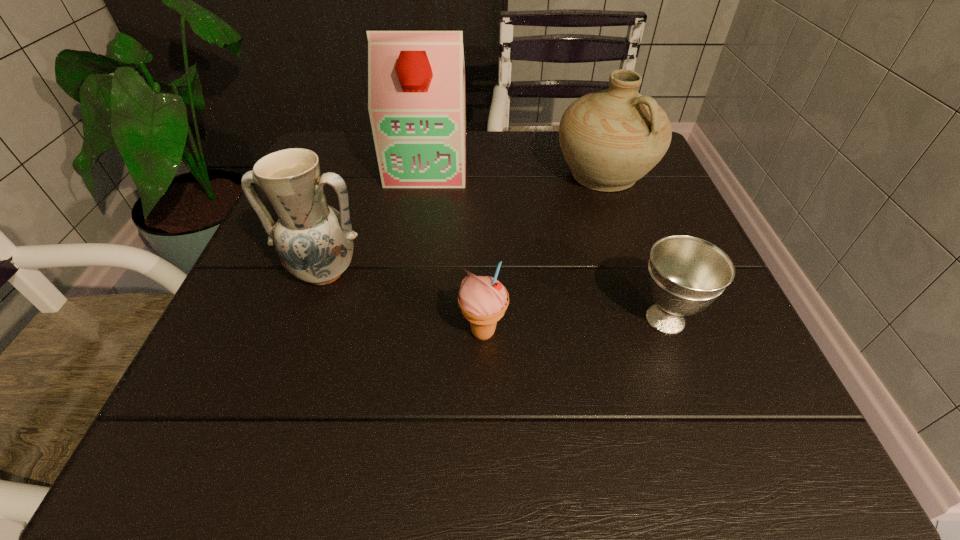
Select which object appears as the closest to the right pottery. Please provide its 2D coordinates. Your answer should be formatted as a tuple, i.e. [(x, y)], where the tuple contains the x and y coordinates of a point satisfying the conditions above.

[(416, 77)]

What are the coordinates of `vacant space that satisfies the following two spatial constraints: 1. on either side of the icecream; 2. on the left side of the left pottery` in the screenshot? It's located at (303, 333).

Find the location of `free space that satisfies the following two spatial constraints: 1. with the cap open on the right pottery; 2. on the right side of the tallest object`. free space that satisfies the following two spatial constraints: 1. with the cap open on the right pottery; 2. on the right side of the tallest object is located at coordinates (426, 175).

Find the location of a particular element. The width and height of the screenshot is (960, 540). vacant space that satisfies the following two spatial constraints: 1. on either side of the icecream; 2. on the right side of the nearer pottery is located at coordinates (303, 333).

Identify the location of free space that satisfies the following two spatial constraints: 1. with the cap open on the third object from right to left; 2. on the right side of the soya milk. The width and height of the screenshot is (960, 540). (402, 333).

Image resolution: width=960 pixels, height=540 pixels. What are the coordinates of `vacant space that satisfies the following two spatial constraints: 1. on the back side of the icecream; 2. on the right side of the chalice` in the screenshot? It's located at (483, 319).

At what (x,y) coordinates should I click in order to perform the action: click on blank space that satisfies the following two spatial constraints: 1. on either side of the icecream; 2. on the left side of the left pottery. Please return your answer as a coordinate pair (x, y). Looking at the image, I should click on (303, 333).